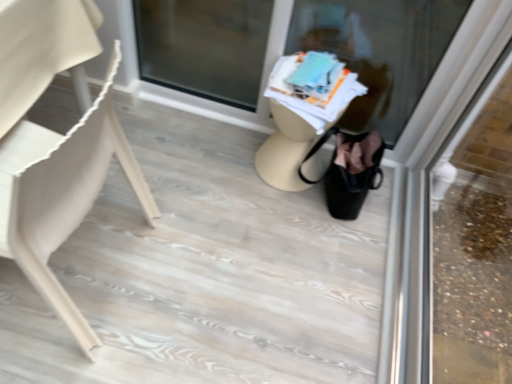
At what (x,y) coordinates should I click in order to perform the action: click on free point above beige matte table at center (from a real-world perspective). Please return your answer as a coordinate pair (x, y). Image resolution: width=512 pixels, height=384 pixels. Looking at the image, I should click on (295, 97).